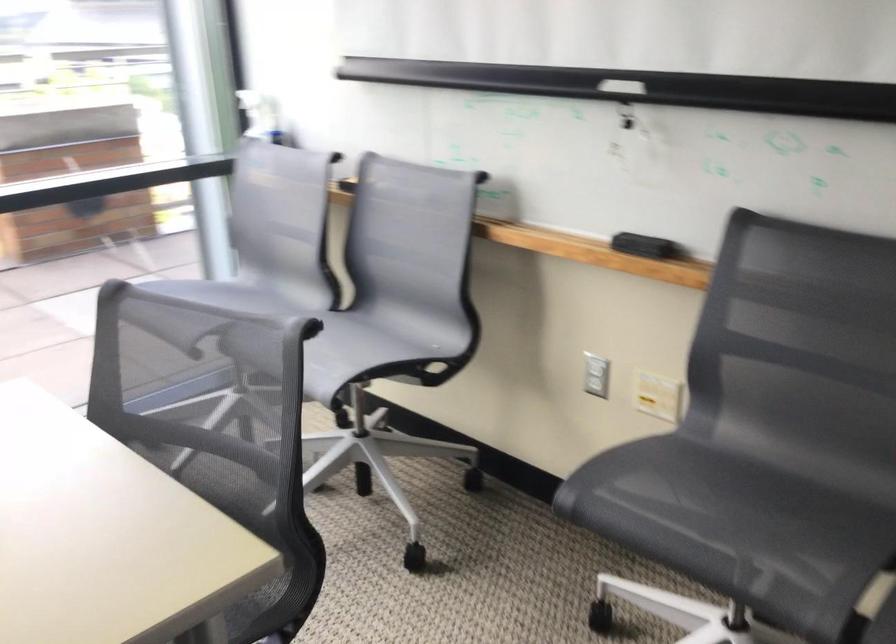
At what (x,y) coordinates should I click in order to perform the action: click on black whiteboard eraser. Please return your answer as a coordinate pair (x, y). Looking at the image, I should click on (643, 245).